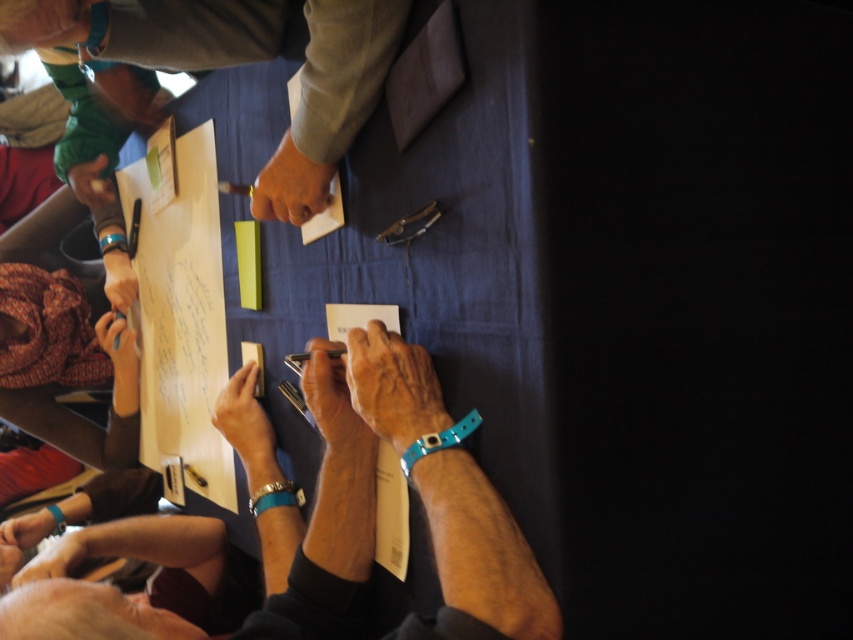
Question: Is yellow paper at center positioned before smooth skin hand at lower left?

Choices:
 (A) no
 (B) yes

Answer: (A)

Question: Can you confirm if smooth brown leather wallet at lower left is smaller than smooth black pen at lower left?

Choices:
 (A) yes
 (B) no

Answer: (B)

Question: Can you confirm if matte black pen at upper center is positioned above smooth skin hand at lower left?

Choices:
 (A) no
 (B) yes

Answer: (B)

Question: Among these objects, which one is nearest to the camera?

Choices:
 (A) smooth skin hand at lower left
 (B) matte green fabric at upper left
 (C) matte black pen at upper center

Answer: (C)

Question: Which point is closer to the camera?

Choices:
 (A) matte green fabric at upper left
 (B) smooth leather wristband at center

Answer: (B)

Question: Which point is closer to the camera?

Choices:
 (A) (302, 180)
 (B) (109, 344)
 (C) (109, 195)

Answer: (A)